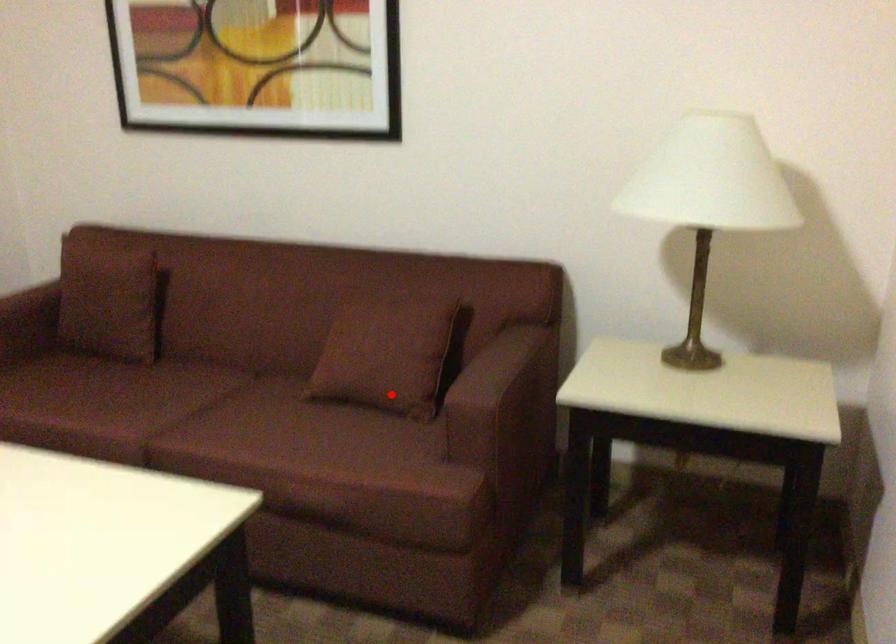
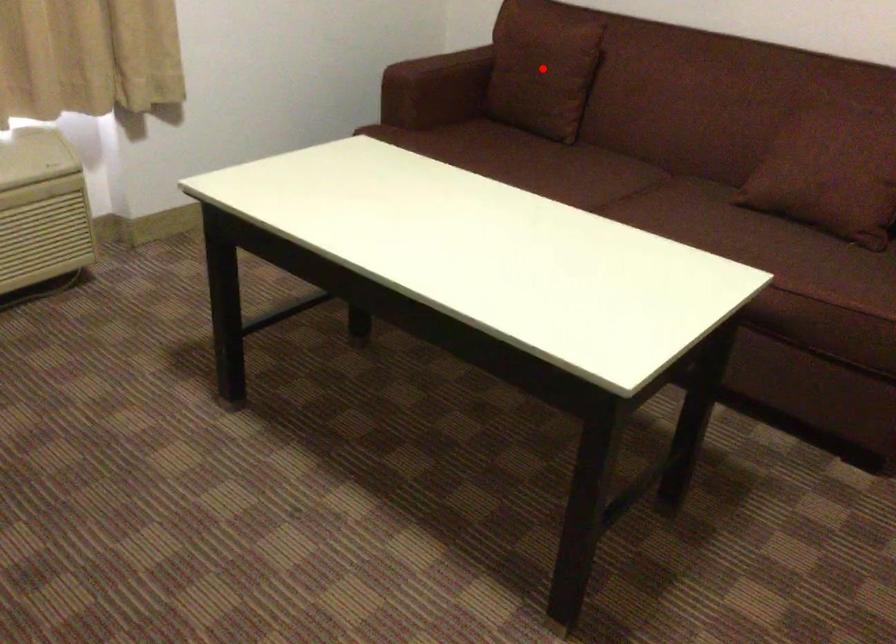
I am providing you with two images of the same scene from different viewpoints. A red point is marked on the first image and another point is marked on the second image. Is the red point in image1 aligned with the point shown in image2?

No